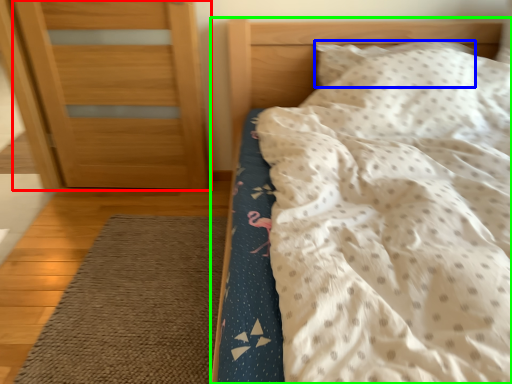
Question: Which object is the closest to the door (highlighted by a red box)? Choose among these: pillow (highlighted by a blue box) or bed (highlighted by a green box).

Choices:
 (A) pillow
 (B) bed

Answer: (B)